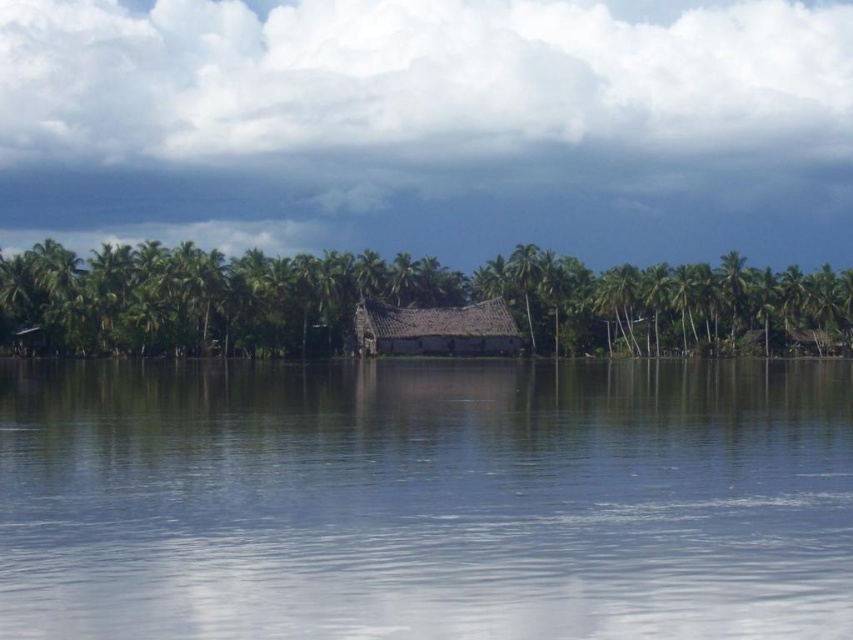
Question: Is brown thatched hut at center thinner than green leafy palm tree at center?

Choices:
 (A) yes
 (B) no

Answer: (B)

Question: Which object is positioned farthest from the clear water at center?

Choices:
 (A) green leafy palm tree at center
 (B) brown thatched hut at center

Answer: (A)

Question: Does green leafy palm tree at center have a smaller size compared to green leafy palm tree at right?

Choices:
 (A) yes
 (B) no

Answer: (A)

Question: Which is nearer to the brown thatched hut at center?

Choices:
 (A) clear water at center
 (B) green leafy palm tree at center
 (C) green leafy palm tree at right

Answer: (B)

Question: Which point is closer to the camera?

Choices:
 (A) (444, 310)
 (B) (727, 272)
 (C) (508, 269)

Answer: (A)

Question: Is clear water at center smaller than brown thatched hut at center?

Choices:
 (A) no
 (B) yes

Answer: (A)